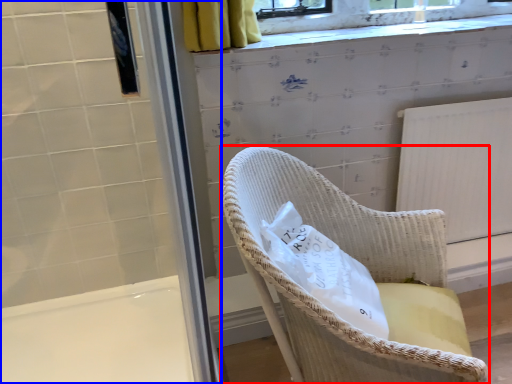
Question: Which of the following is the farthest to the observer, chair (highlighted by a red box) or screen door (highlighted by a blue box)?

Choices:
 (A) chair
 (B) screen door

Answer: (B)